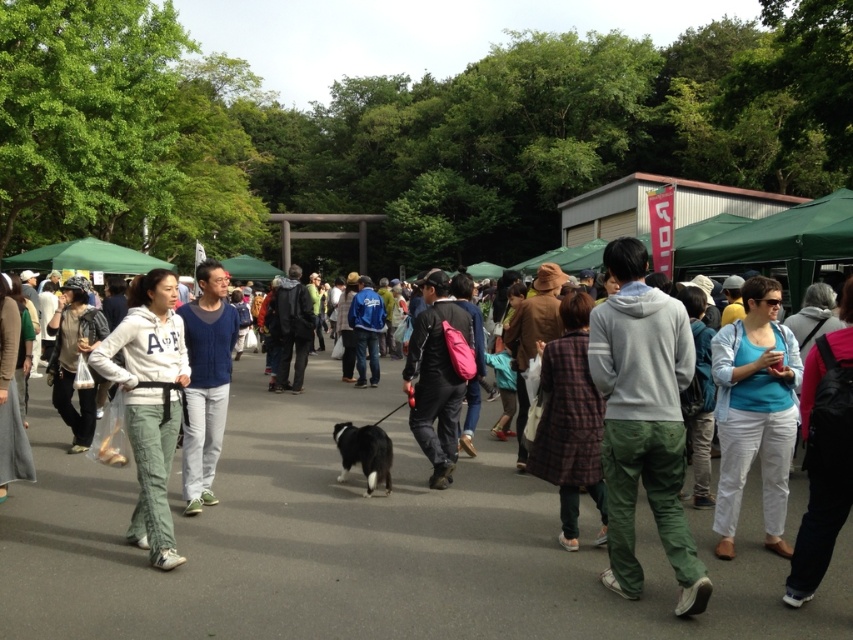
You are standing on the paved pathway and want to reach the ice cream cart located behind the matte blue sweater at center. Can you easily walk around the white cotton hoodie at center to get there?

The white cotton hoodie at center is in front of the matte blue sweater at center, so you can easily walk around the white cotton hoodie at center to reach the matte blue sweater at center and the ice cream cart behind it.